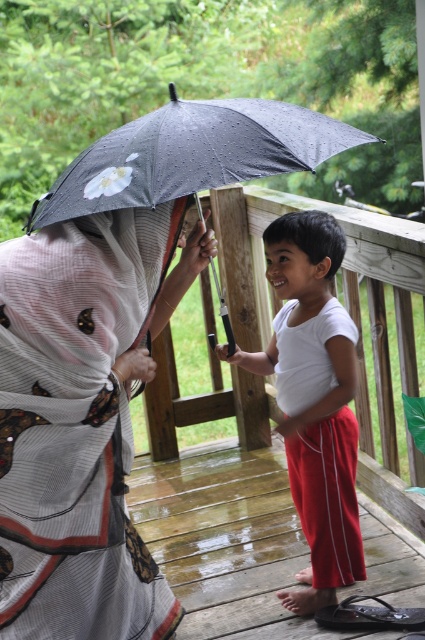
Question: Which object is positioned farthest from the matte gray scarf at upper left?

Choices:
 (A) white cotton shirt at center
 (B) wet wooden deck at lower center
 (C) black dotted umbrella at center

Answer: (B)

Question: Does white cotton shirt at center appear on the right side of black dotted umbrella at center?

Choices:
 (A) no
 (B) yes

Answer: (B)

Question: Does matte gray scarf at upper left appear over wet wooden deck at lower center?

Choices:
 (A) yes
 (B) no

Answer: (A)

Question: Which object appears farthest from the camera in this image?

Choices:
 (A) wet wooden deck at lower center
 (B) white cotton shirt at center

Answer: (A)

Question: Does wet wooden deck at lower center appear under white cotton shirt at center?

Choices:
 (A) yes
 (B) no

Answer: (A)

Question: Which of the following is the farthest from the observer?

Choices:
 (A) pos(306,440)
 (B) pos(184,180)
 (C) pos(44,365)

Answer: (A)